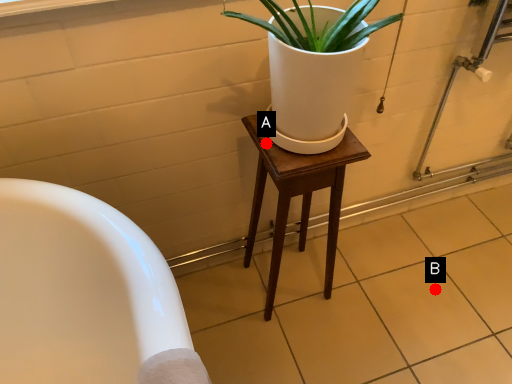
Question: Two points are circled on the image, labeled by A and B beside each circle. Which point is closer to the camera?

Choices:
 (A) A is closer
 (B) B is closer

Answer: (A)